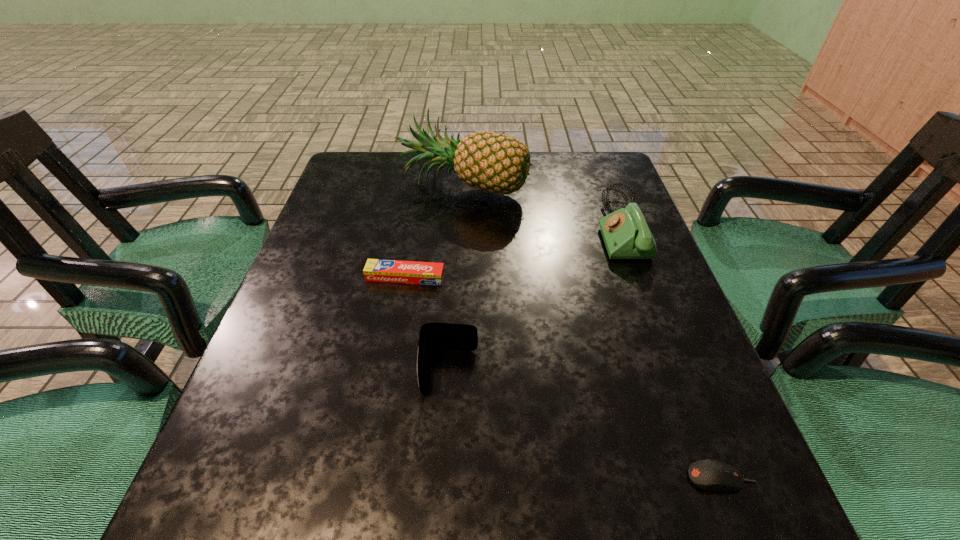
Identify the location of free space at the far edge of the desktop. 456,197.

At what (x,y) coordinates should I click in order to perform the action: click on free region at the near edge of the desktop. Please return your answer as a coordinate pair (x, y). The height and width of the screenshot is (540, 960). Looking at the image, I should click on (468, 539).

The width and height of the screenshot is (960, 540). Find the location of `vacant area at the left edge`. vacant area at the left edge is located at coordinates (315, 327).

Locate an element on the screen. This screenshot has height=540, width=960. free point at the right edge is located at coordinates (647, 368).

The width and height of the screenshot is (960, 540). In the image, there is a desktop. Identify the location of vacant space at the far left corner. (366, 171).

The image size is (960, 540). What are the coordinates of `blank space at the near left corner` in the screenshot? It's located at (259, 512).

Locate an element on the screen. The image size is (960, 540). vacant space that's between the wallet and the telephone is located at coordinates (535, 299).

This screenshot has width=960, height=540. Find the location of `free space between the computer mouse and the pineapple`. free space between the computer mouse and the pineapple is located at coordinates (592, 331).

Locate an element on the screen. The height and width of the screenshot is (540, 960). empty space that is in between the tallest object and the telephone is located at coordinates 541,205.

What are the coordinates of `vacant area that lies between the tallest object and the nearest object` in the screenshot? It's located at coord(592,331).